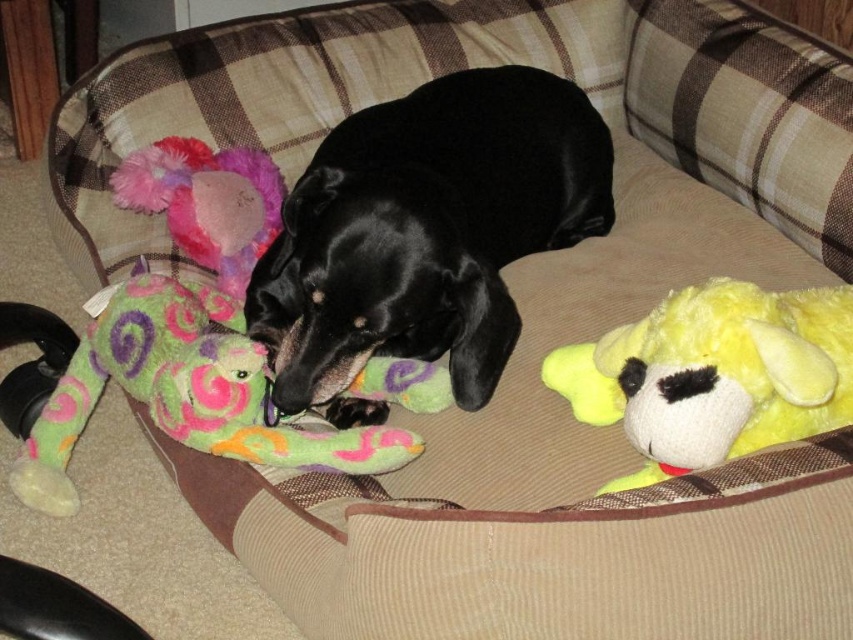
Between black glossy dog at center and yellow plush dog at right, which one appears on the left side from the viewer's perspective?

Positioned to the left is black glossy dog at center.

Does black glossy dog at center appear on the left side of yellow plush dog at right?

Indeed, black glossy dog at center is positioned on the left side of yellow plush dog at right.

Identify the location of black glossy dog at center. This screenshot has width=853, height=640. (425, 234).

Image resolution: width=853 pixels, height=640 pixels. I want to click on black glossy dog at center, so click(425, 234).

Who is higher up, multicolored plush toy at left or yellow plush dog at right?

Positioned higher is yellow plush dog at right.

You are a GUI agent. You are given a task and a screenshot of the screen. Output one action in this format:
    pyautogui.click(x=<x>, y=<y>)
    Task: Click on the multicolored plush toy at left
    
    Given the screenshot: What is the action you would take?
    pyautogui.click(x=184, y=392)

Is point (279, 422) positioned behind point (241, 189)?

That is False.

Identify the location of multicolored plush toy at left. The image size is (853, 640). (184, 392).

Identify the location of multicolored plush toy at left. (184, 392).